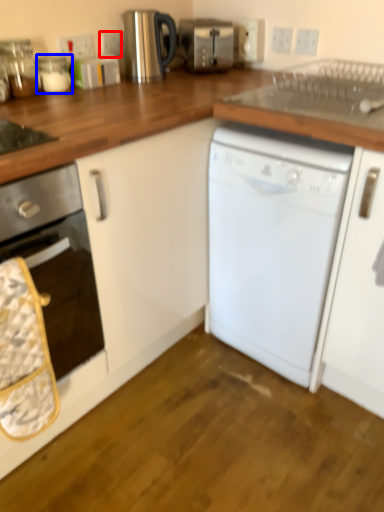
Question: Which point is closer to the camera, electric outlet (highlighted by a red box) or appliance (highlighted by a blue box)?

Choices:
 (A) electric outlet
 (B) appliance

Answer: (B)